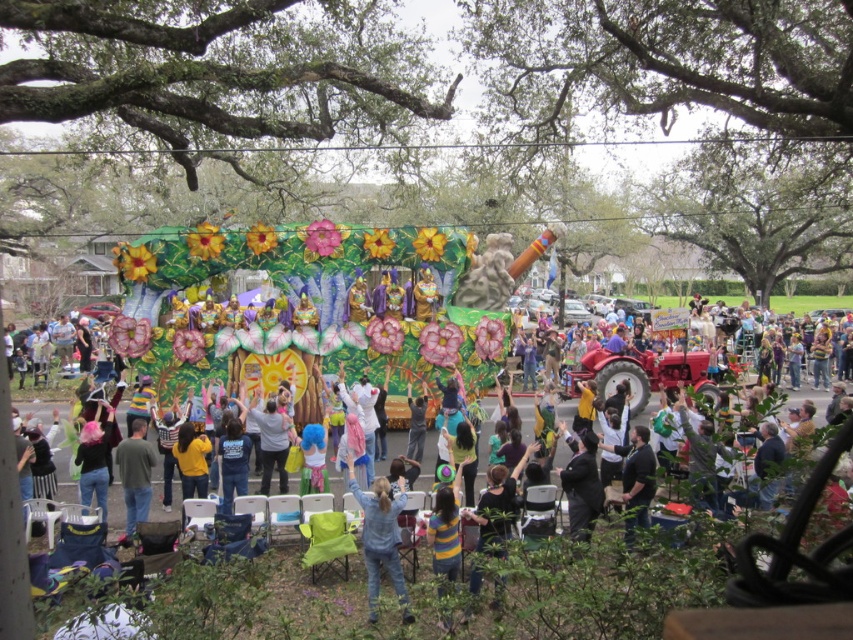
Question: Does denim jacket at center have a larger size compared to gray cotton shirt at lower left?

Choices:
 (A) yes
 (B) no

Answer: (A)

Question: Does denim jacket at center appear on the left side of gray cotton shirt at lower left?

Choices:
 (A) no
 (B) yes

Answer: (A)

Question: Which of the following is the farthest from the observer?

Choices:
 (A) gray cotton shirt at lower left
 (B) denim jacket at center

Answer: (A)

Question: Which of the following is the closest to the observer?

Choices:
 (A) denim jacket at center
 (B) gray cotton shirt at lower left

Answer: (A)

Question: In this image, where is denim jacket at center located relative to gray cotton shirt at lower left?

Choices:
 (A) right
 (B) left

Answer: (A)